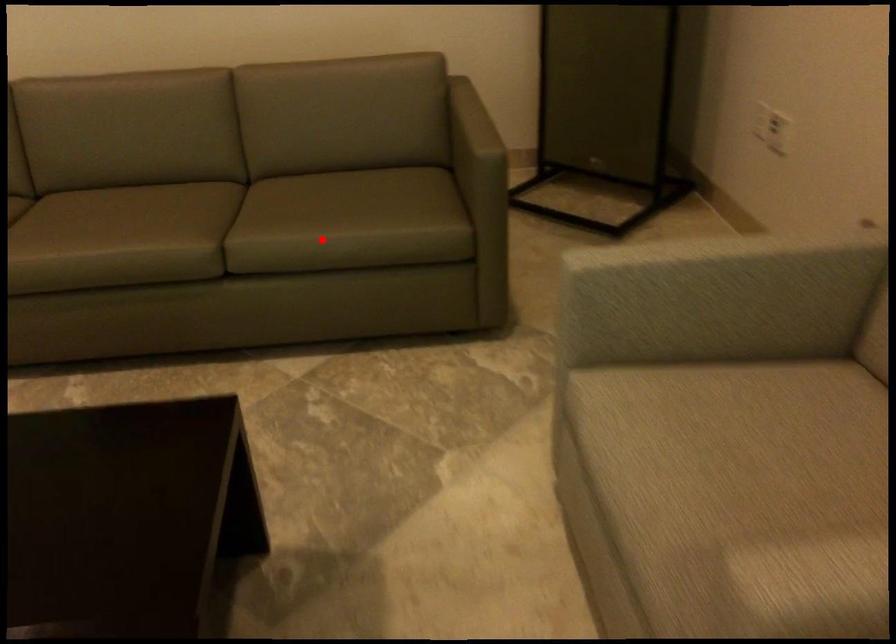
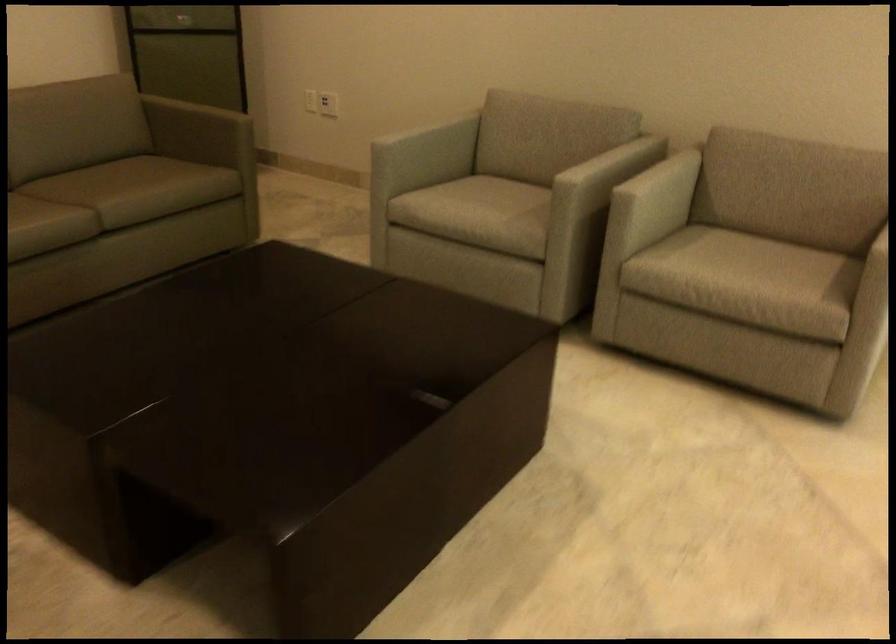
Locate, in the second image, the point that corresponds to the highlighted location in the first image.

(145, 187)